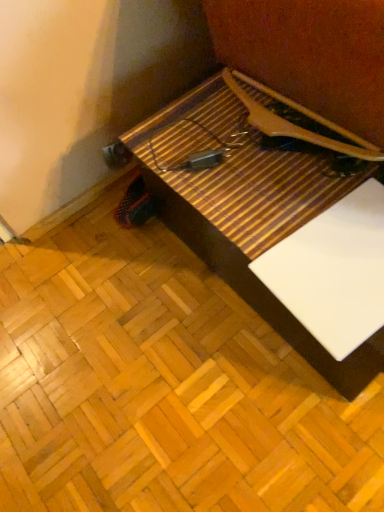
Question: Is wooden table at center smaller than white matte paper at lower right?

Choices:
 (A) yes
 (B) no

Answer: (B)

Question: Does wooden table at center contain white matte paper at lower right?

Choices:
 (A) no
 (B) yes

Answer: (B)

Question: Can you confirm if wooden table at center is positioned to the right of white matte paper at lower right?

Choices:
 (A) yes
 (B) no

Answer: (B)

Question: Is wooden table at center in contact with white matte paper at lower right?

Choices:
 (A) yes
 (B) no

Answer: (B)

Question: Considering the relative positions of wooden table at center and white matte paper at lower right in the image provided, is wooden table at center in front of white matte paper at lower right?

Choices:
 (A) no
 (B) yes

Answer: (B)

Question: From the image's perspective, is wooden table at center on white matte paper at lower right?

Choices:
 (A) no
 (B) yes

Answer: (B)

Question: From a real-world perspective, does white matte paper at lower right stand above wooden table at center?

Choices:
 (A) no
 (B) yes

Answer: (B)

Question: Is white matte paper at lower right outside wooden table at center?

Choices:
 (A) yes
 (B) no

Answer: (B)

Question: Can you confirm if white matte paper at lower right is wider than wooden table at center?

Choices:
 (A) no
 (B) yes

Answer: (A)

Question: Does white matte paper at lower right contain wooden table at center?

Choices:
 (A) no
 (B) yes

Answer: (A)

Question: Does white matte paper at lower right have a lesser height compared to wooden table at center?

Choices:
 (A) yes
 (B) no

Answer: (A)

Question: Is white matte paper at lower right touching wooden table at center?

Choices:
 (A) yes
 (B) no

Answer: (B)

Question: From the image's perspective, is white matte paper at lower right above or below wooden table at center?

Choices:
 (A) above
 (B) below

Answer: (B)